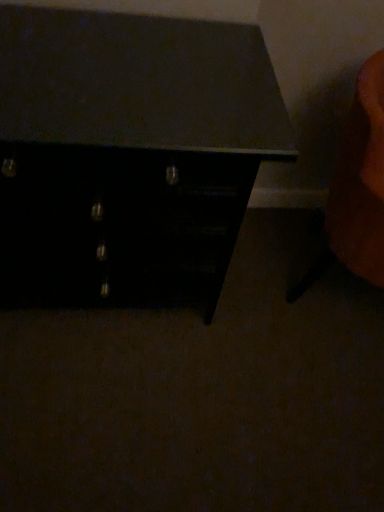
Find the location of a particular element. The width and height of the screenshot is (384, 512). vacant space situated above matte black chest of drawers at center (from a real-world perspective) is located at coordinates (122, 78).